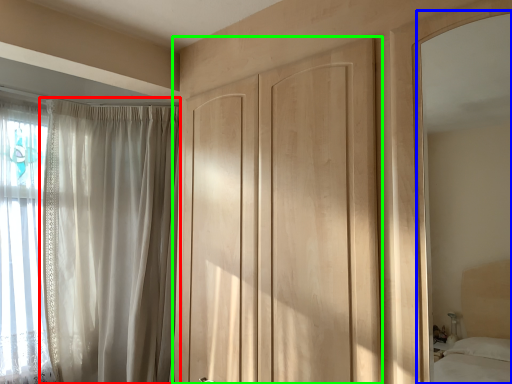
Question: Which is nearer to the curtain (highlighted by a red box)? mirror (highlighted by a blue box) or door (highlighted by a green box).

Choices:
 (A) mirror
 (B) door

Answer: (B)